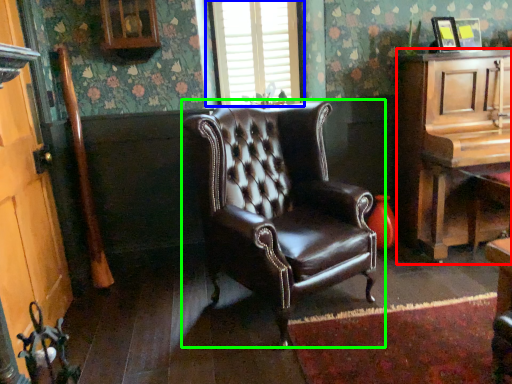
Question: Which object is positioned farthest from cabinetry (highlighted by a red box)? Select from window (highlighted by a blue box) and chair (highlighted by a green box).

Choices:
 (A) window
 (B) chair

Answer: (A)